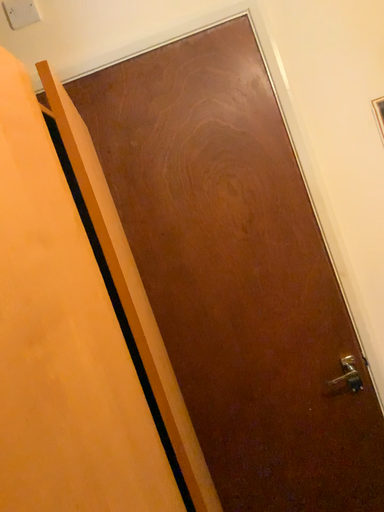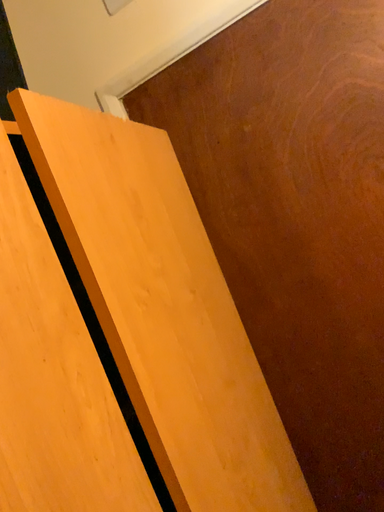
Question: Which way did the camera rotate in the video?

Choices:
 (A) rotated left
 (B) rotated right

Answer: (A)